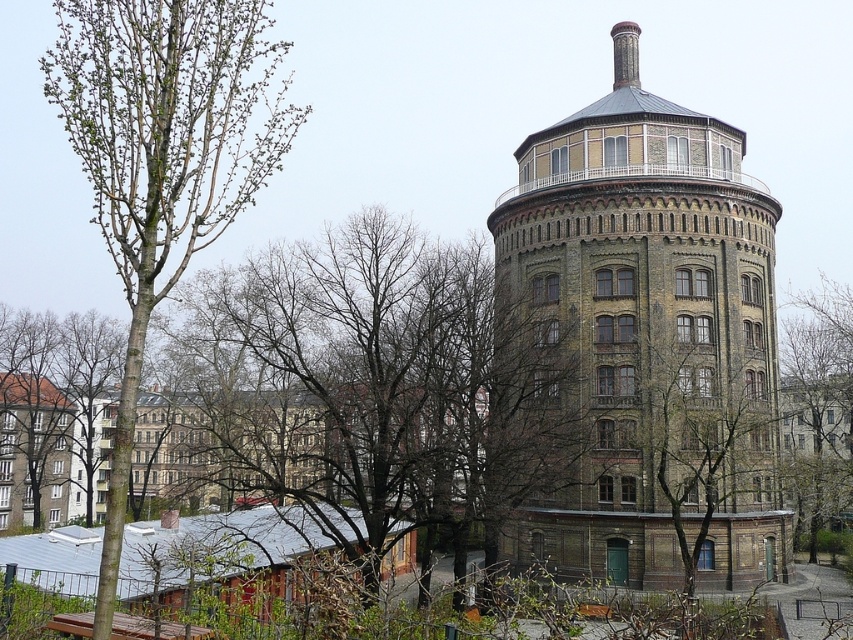
You are a city planner assessing the spacing between the brown brick tower at right and the green leafy tree at upper right. Given that local regulations require a minimum distance of 60 feet between such structures for safety, does the current spacing meet the requirement?

The brown brick tower at right is 63.66 feet from the green leafy tree at upper right, which exceeds the required 60 feet, so the spacing meets the safety regulations.